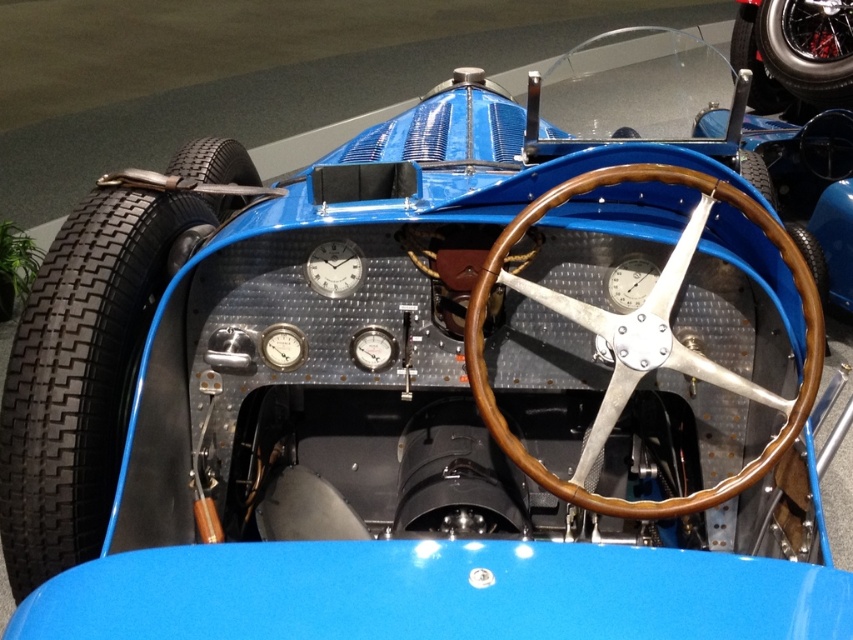
Question: Does brown wood/leather steering wheel at center appear under brown wood steering wheel at center?

Choices:
 (A) no
 (B) yes

Answer: (B)

Question: Can you confirm if shiny black tire at upper right is thinner than brown wood steering wheel at center?

Choices:
 (A) yes
 (B) no

Answer: (B)

Question: Which point is closer to the camera taking this photo?

Choices:
 (A) (33, 300)
 (B) (778, 108)

Answer: (A)

Question: Is shiny chrome wheel at upper right closer to the viewer compared to brown wood steering wheel at center?

Choices:
 (A) no
 (B) yes

Answer: (A)

Question: Which of the following is the closest to the observer?

Choices:
 (A) brown wood/leather steering wheel at center
 (B) shiny chrome wheel at upper right
 (C) shiny black tire at upper right

Answer: (A)

Question: Which object is positioned closest to the brown wood steering wheel at center?

Choices:
 (A) shiny black tire at upper right
 (B) shiny chrome wheel at upper right
 (C) black rubber tire at left
 (D) brown wood/leather steering wheel at center

Answer: (D)